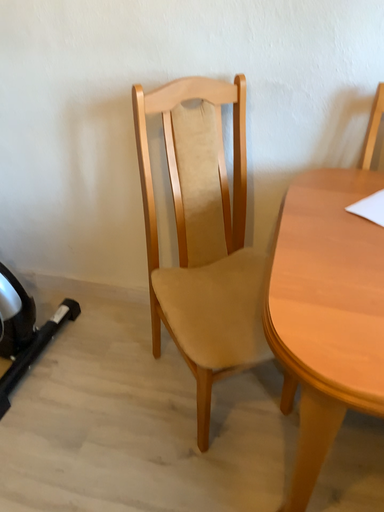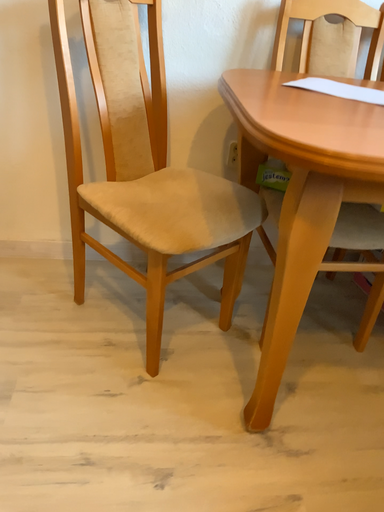
Question: How did the camera likely rotate when shooting the video?

Choices:
 (A) rotated left
 (B) rotated right

Answer: (B)